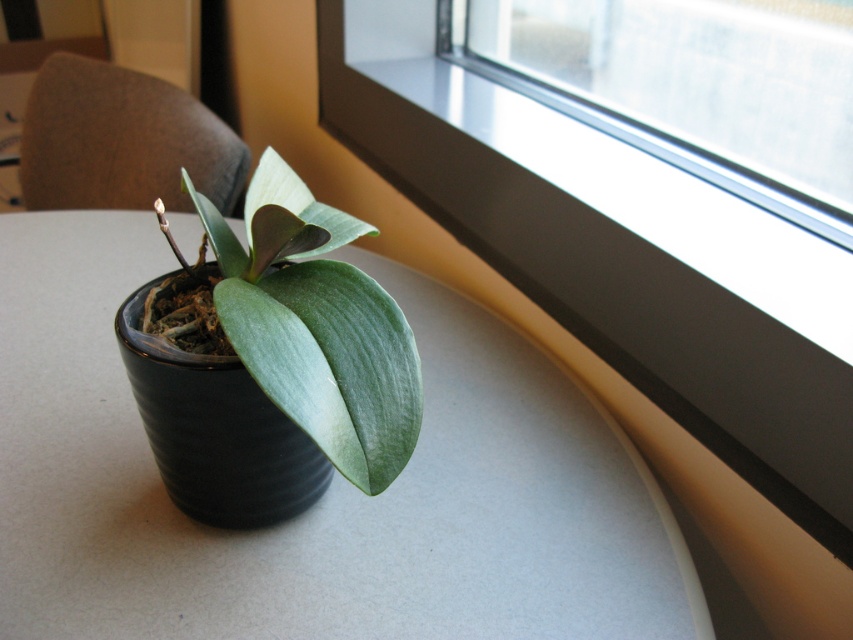
You are a gardener who needs to water the plant. You have a watering can and see the transparent glass at upper right and the green matte leaf at center. Which object is closer to you that you should avoid spilling water on?

The transparent glass at upper right is closer to you than the green matte leaf at center, so you should avoid spilling water on the transparent glass at upper right to prevent slipping.

You are organizing a small table and need to place both the transparent glass at upper right and the black ceramic vase at center. If you want to use the larger item as a centerpiece, which object should you choose?

The transparent glass at upper right should be chosen as the centerpiece because it has a larger size compared to the black ceramic vase at center.

You are arranging flowers and see the transparent glass at upper right and the green matte leaf at center. Which object is located to the right of the other?

The transparent glass at upper right is positioned on the right side of green matte leaf at center.